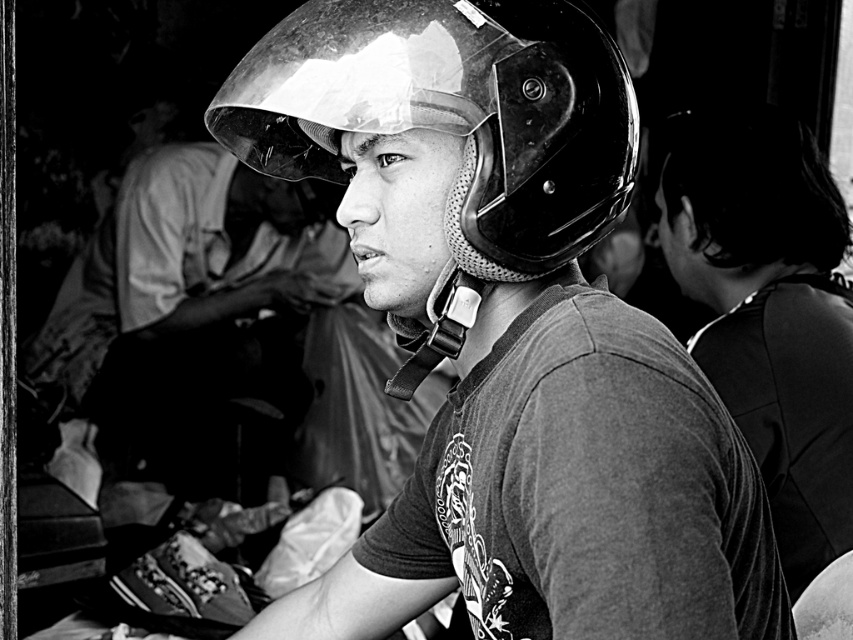
Based on the photo, is glossy black helmet at center thinner than smooth black shirt at center?

No, glossy black helmet at center is not thinner than smooth black shirt at center.

Is glossy black helmet at center further to the viewer compared to smooth black shirt at center?

No, it is in front of smooth black shirt at center.

Measure the distance between point (692, 476) and camera.

Point (692, 476) and camera are 32.77 inches apart.

Where is `glossy black helmet at center`? This screenshot has height=640, width=853. glossy black helmet at center is located at coordinates (508, 332).

In the scene shown: Which is below, glossy black helmet at center or shiny black helmet at center?

glossy black helmet at center is lower down.

Does glossy black helmet at center have a lesser height compared to shiny black helmet at center?

No, glossy black helmet at center is not shorter than shiny black helmet at center.

Is point (419, 257) positioned before point (529, 17)?

No, it is not.

At what (x,y) coordinates should I click in order to perform the action: click on glossy black helmet at center. Please return your answer as a coordinate pair (x, y). This screenshot has height=640, width=853. Looking at the image, I should click on point(508,332).

Between shiny black helmet at center and smooth black shirt at center, which one has more height?

Standing taller between the two is smooth black shirt at center.

Is point (463, 138) behind point (796, 312)?

No, (463, 138) is closer to viewer.

Where is `shiny black helmet at center`? Image resolution: width=853 pixels, height=640 pixels. shiny black helmet at center is located at coordinates (451, 131).